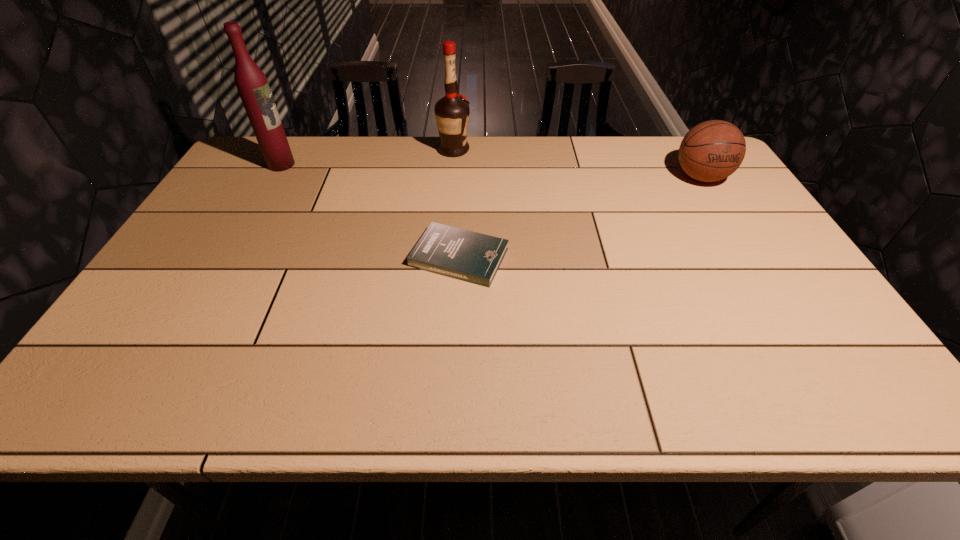
Where is `free space between the rightmost object and the tallest object`? free space between the rightmost object and the tallest object is located at coordinates (491, 171).

Locate an element on the screen. This screenshot has width=960, height=540. empty space that is in between the book and the rightmost object is located at coordinates (580, 217).

Locate an element on the screen. This screenshot has width=960, height=540. free point between the leftmost object and the right liquor is located at coordinates (368, 157).

This screenshot has width=960, height=540. What are the coordinates of `the closest object relative to the tallest object` in the screenshot? It's located at (452, 111).

Find the location of a particular element. The image size is (960, 540). the third closest object to the taller liquor is located at coordinates (711, 151).

The height and width of the screenshot is (540, 960). What are the coordinates of `free space that satisfies the following two spatial constraints: 1. on the label of the left liquor; 2. on the left side of the book` in the screenshot? It's located at (228, 257).

Find the location of a particular element. The height and width of the screenshot is (540, 960). free location that satisfies the following two spatial constraints: 1. on the back side of the nearest object; 2. on the label of the leftmost object is located at coordinates (464, 165).

Locate an element on the screen. Image resolution: width=960 pixels, height=540 pixels. vacant space that satisfies the following two spatial constraints: 1. on the label of the tallest object; 2. on the back side of the shortest object is located at coordinates (228, 257).

Locate an element on the screen. free space that satisfies the following two spatial constraints: 1. on the front and back of the second tallest object; 2. on the left side of the shortest object is located at coordinates (445, 257).

Identify the location of vacant area in the image that satisfies the following two spatial constraints: 1. on the back side of the nearest object; 2. on the label of the taller liquor. This screenshot has height=540, width=960. (464, 165).